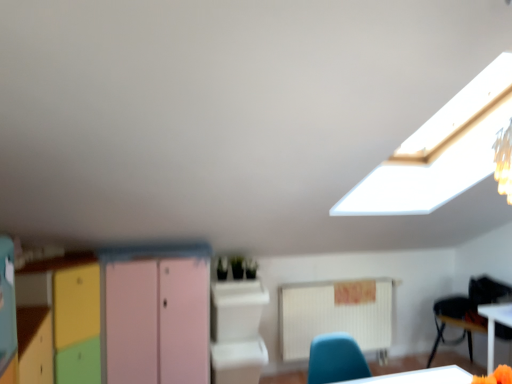
Question: From the image's perspective, is white glossy table at lower right beneath white glossy computer desk at center?

Choices:
 (A) no
 (B) yes

Answer: (B)

Question: Is white glossy table at lower right outside white glossy computer desk at center?

Choices:
 (A) yes
 (B) no

Answer: (A)

Question: From the image's perspective, would you say white glossy table at lower right is positioned over white glossy computer desk at center?

Choices:
 (A) no
 (B) yes

Answer: (A)

Question: Could white glossy computer desk at center be considered to be inside white glossy table at lower right?

Choices:
 (A) no
 (B) yes

Answer: (A)

Question: Can you confirm if white glossy table at lower right is bigger than white glossy computer desk at center?

Choices:
 (A) no
 (B) yes

Answer: (A)

Question: From the image's perspective, is white glossy table at lower right above or below pink matte/file cabinet at center?

Choices:
 (A) below
 (B) above

Answer: (B)

Question: From a real-world perspective, is white glossy table at lower right positioned above or below pink matte/file cabinet at center?

Choices:
 (A) below
 (B) above

Answer: (B)

Question: In terms of size, does white glossy table at lower right appear bigger or smaller than pink matte/file cabinet at center?

Choices:
 (A) big
 (B) small

Answer: (B)

Question: In the image, is white glossy table at lower right on the left side or the right side of pink matte/file cabinet at center?

Choices:
 (A) left
 (B) right

Answer: (B)

Question: Looking at their shapes, would you say white plastic chair at lower right is wider or thinner than pink matte/file cabinet at center?

Choices:
 (A) wide
 (B) thin

Answer: (A)

Question: Is white plastic chair at lower right to the left or to the right of pink matte/file cabinet at center in the image?

Choices:
 (A) right
 (B) left

Answer: (A)

Question: Is white plastic chair at lower right inside or outside of pink matte/file cabinet at center?

Choices:
 (A) outside
 (B) inside

Answer: (A)

Question: From a real-world perspective, is white plastic chair at lower right positioned above or below pink matte/file cabinet at center?

Choices:
 (A) above
 (B) below

Answer: (B)

Question: Is white glossy table at lower right in front of or behind pastel wood cabinet at center in the image?

Choices:
 (A) front
 (B) behind

Answer: (B)

Question: Based on their sizes in the image, would you say white glossy table at lower right is bigger or smaller than pastel wood cabinet at center?

Choices:
 (A) small
 (B) big

Answer: (A)